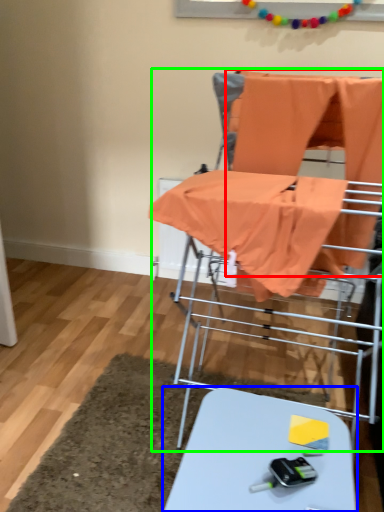
Question: Which object is the farthest from fabric (highlighted by a red box)? Choose among these: table (highlighted by a blue box) or baby carriage (highlighted by a green box).

Choices:
 (A) table
 (B) baby carriage

Answer: (A)